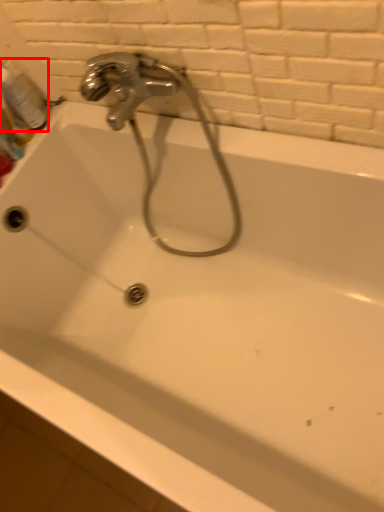
Question: From the image's perspective, what is the correct spatial relationship of mouthwash (annotated by the red box) in relation to plumbing fixture?

Choices:
 (A) below
 (B) above

Answer: (B)